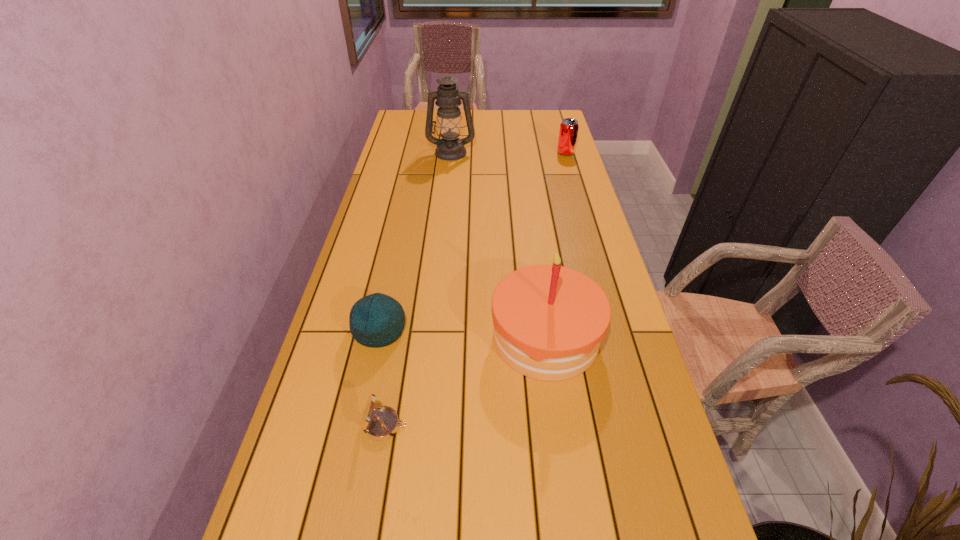
The height and width of the screenshot is (540, 960). In order to click on vacant area situated 0.210m on the right of the beanie in this screenshot , I will do click(x=486, y=330).

I want to click on free space located 0.240m with the dial facing the nearest object, so coord(516,426).

At what (x,y) coordinates should I click in order to perform the action: click on beanie at the left edge. Please return your answer as a coordinate pair (x, y). The width and height of the screenshot is (960, 540). Looking at the image, I should click on (376, 320).

What are the coordinates of `compass that is at the left edge` in the screenshot? It's located at (381, 423).

Locate an element on the screen. The height and width of the screenshot is (540, 960). birthday cake located at the right edge is located at coordinates (549, 320).

You are a GUI agent. You are given a task and a screenshot of the screen. Output one action in this format:
    pyautogui.click(x=<x>, y=<y>)
    Task: Click on the soda can located in the right edge section of the desktop
    The width and height of the screenshot is (960, 540).
    Given the screenshot: What is the action you would take?
    pyautogui.click(x=568, y=132)

Identify the location of blank space at the left edge. (400, 193).

Image resolution: width=960 pixels, height=540 pixels. Find the location of `blank area at the right edge`. blank area at the right edge is located at coordinates (553, 146).

Locate an element on the screen. This screenshot has width=960, height=540. vacant region at the far right corner of the desktop is located at coordinates [x=546, y=115].

Where is `vacant space that's between the second object from right to left and the second shortest object`? This screenshot has width=960, height=540. vacant space that's between the second object from right to left and the second shortest object is located at coordinates (463, 334).